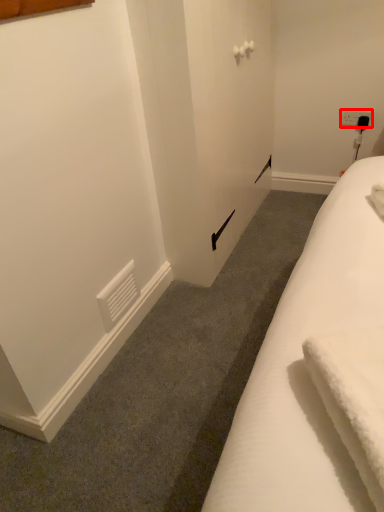
Question: From the image, what is the correct spatial relationship of electric outlet (annotated by the red box) in relation to bath towel?

Choices:
 (A) left
 (B) right

Answer: (B)